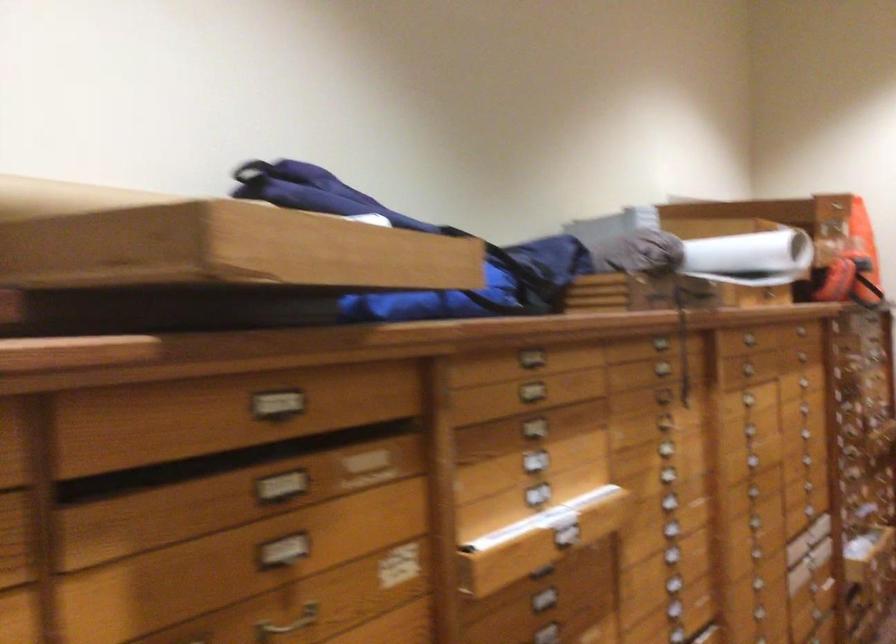
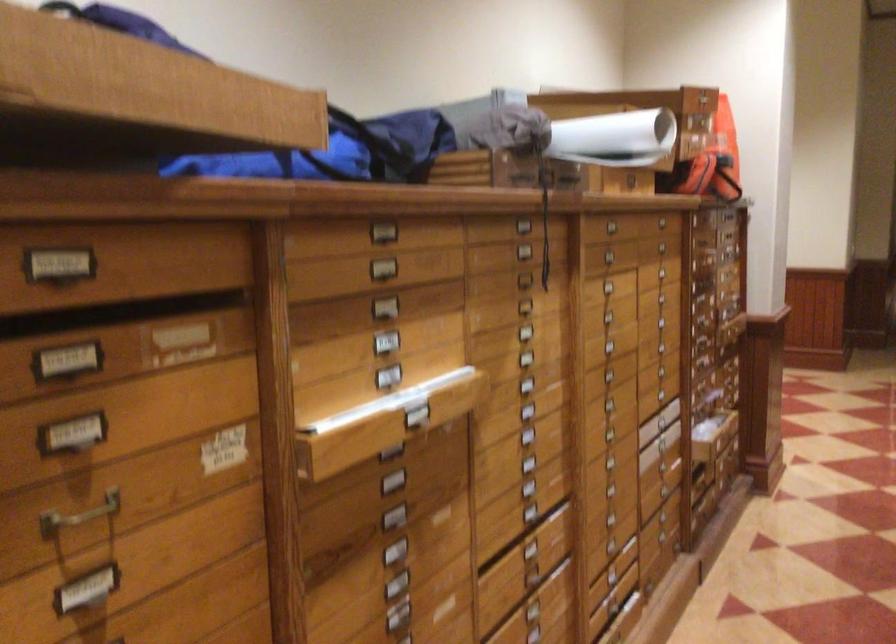
Locate, in the second image, the point that corresponds to [336,270] in the first image.

(135, 95)